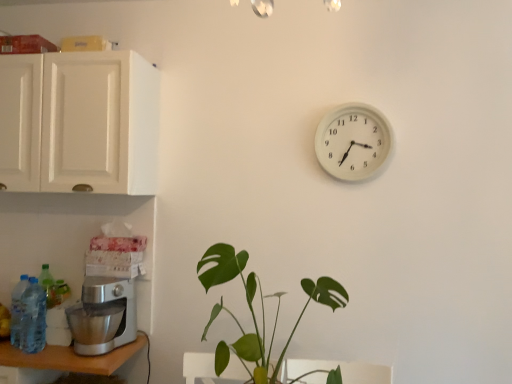
I want to click on free space in front of blue plastic bottle at lower left, the 1th bottle viewed from the right, so click(x=27, y=357).